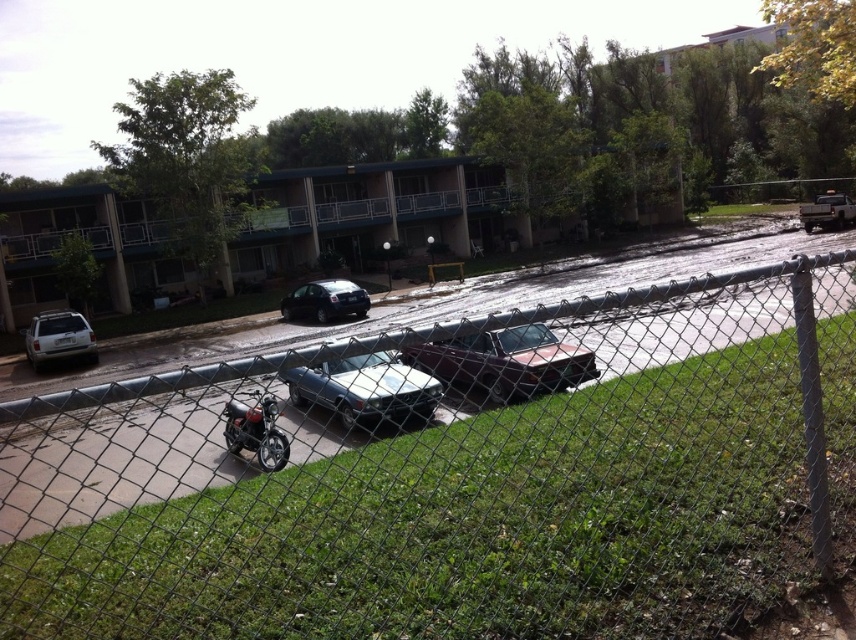
The height and width of the screenshot is (640, 856). Describe the element at coordinates (504, 362) in the screenshot. I see `maroon metallic sedan at center` at that location.

Does point (587, 369) come farther from viewer compared to point (58, 349)?

No, it is in front of (58, 349).

Is point (516, 365) positioned before point (61, 326)?

Yes, point (516, 365) is closer to viewer.

Locate an element on the screen. The image size is (856, 640). maroon metallic sedan at center is located at coordinates (504, 362).

Is shiny silver sedan at center to the right of shiny chrome motorcycle at lower left from the viewer's perspective?

Correct, you'll find shiny silver sedan at center to the right of shiny chrome motorcycle at lower left.

Between shiny silver sedan at center and shiny chrome motorcycle at lower left, which one has less height?

shiny silver sedan at center

Find the location of `shiny silver sedan at center`. shiny silver sedan at center is located at coordinates (364, 388).

Find the location of a particular element. The height and width of the screenshot is (640, 856). shiny silver sedan at center is located at coordinates (364, 388).

Between maroon metallic sedan at center and glossy black car at center, which one is positioned higher?

glossy black car at center

Can you confirm if maroon metallic sedan at center is taller than glossy black car at center?

Incorrect, maroon metallic sedan at center's height is not larger of glossy black car at center's.

Between point (532, 328) and point (319, 285), which one is positioned behind?

Positioned behind is point (319, 285).

Identify the location of maroon metallic sedan at center. Image resolution: width=856 pixels, height=640 pixels. (504, 362).